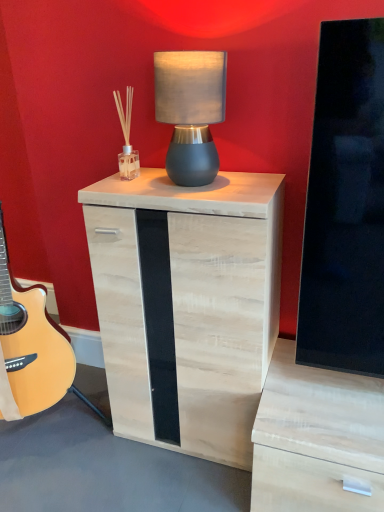
I want to click on free point below matte gray lampshade at center (from a real-world perspective), so click(x=205, y=182).